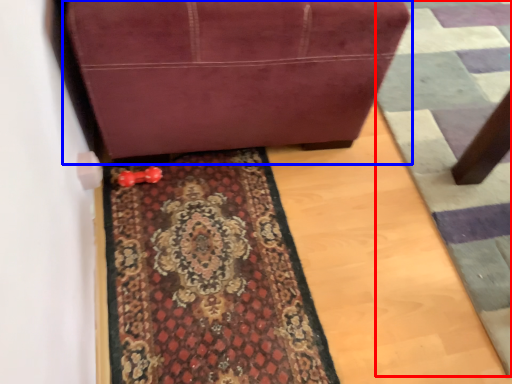
Question: Among these objects, which one is farthest to the camera, doormat (highlighted by a red box) or furniture (highlighted by a blue box)?

Choices:
 (A) doormat
 (B) furniture

Answer: (A)